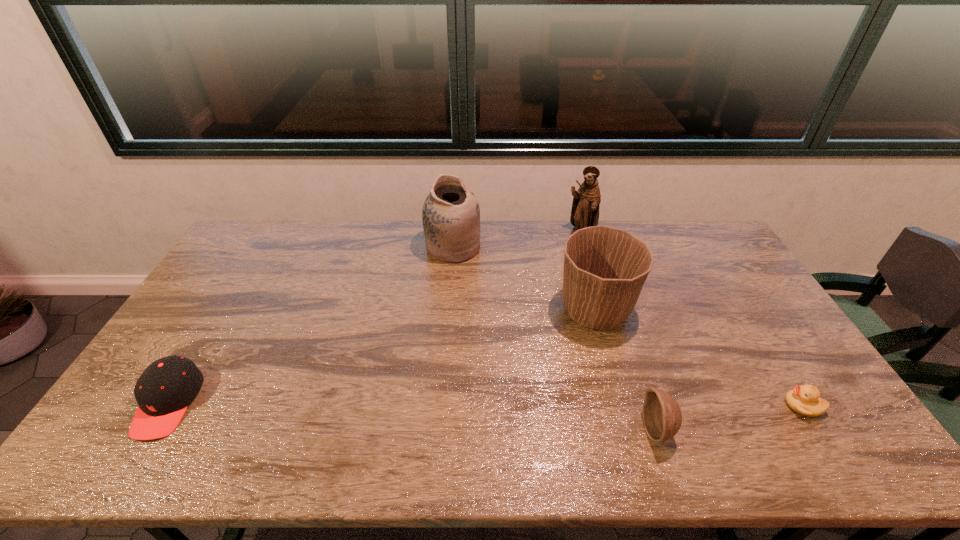
At what (x,y) coordinates should I click in order to perform the action: click on vacant area that lies between the fourth nearest object and the rightmost object. Please return your answer as a coordinate pair (x, y). This screenshot has height=540, width=960. Looking at the image, I should click on (699, 358).

Find the location of a particular element. The height and width of the screenshot is (540, 960). free space that is in between the bowl and the fifth object from right to left is located at coordinates (555, 339).

Where is `unoccupied position between the fourth tallest object and the flowerpot`? Image resolution: width=960 pixels, height=540 pixels. unoccupied position between the fourth tallest object and the flowerpot is located at coordinates click(626, 370).

In order to click on empty location between the shortest object and the figurine in this screenshot , I will do `click(691, 320)`.

Find the location of a particular element. The image size is (960, 540). free spot between the figurine and the fifth object from right to left is located at coordinates (516, 241).

Where is `vacant area that lies between the fourth tallest object and the shortest object`? vacant area that lies between the fourth tallest object and the shortest object is located at coordinates (730, 417).

Locate an element on the screen. Image resolution: width=960 pixels, height=540 pixels. the fourth closest object relative to the flowerpot is located at coordinates (805, 400).

This screenshot has height=540, width=960. Find the location of `object that is the fourth closest one to the bowl`. object that is the fourth closest one to the bowl is located at coordinates [585, 208].

Identify the location of free spot that satisfies the following two spatial constraints: 1. on the front-facing side of the cap; 2. on the left side of the bowl. Image resolution: width=960 pixels, height=540 pixels. (153, 429).

Locate an element on the screen. Image resolution: width=960 pixels, height=540 pixels. free space that satisfies the following two spatial constraints: 1. on the front-facing side of the bowl; 2. on the left side of the figurine is located at coordinates (637, 429).